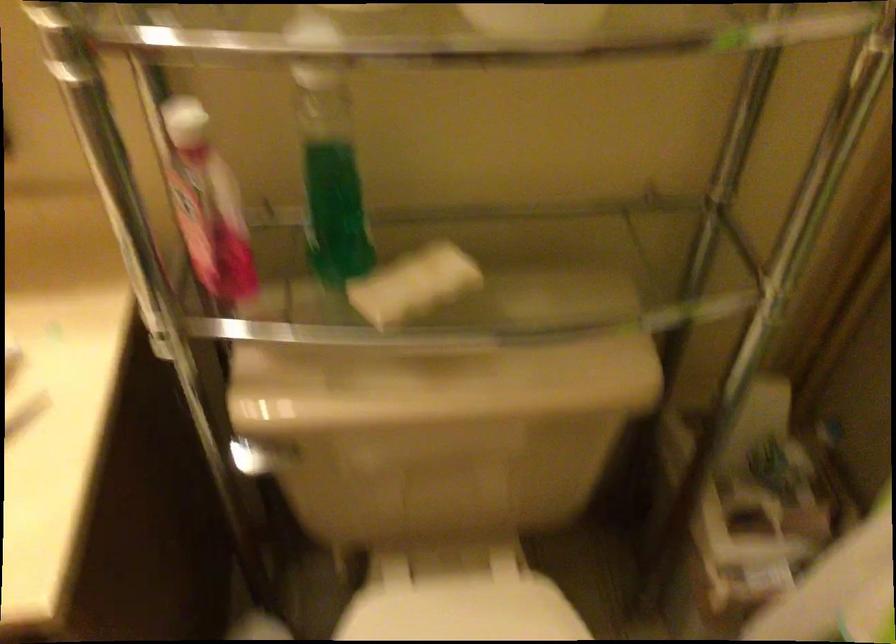
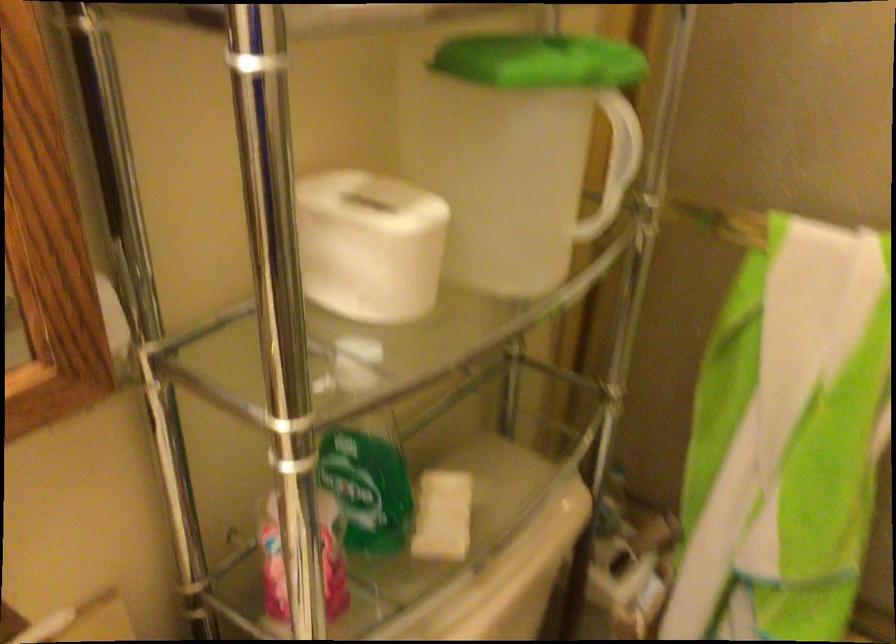
The point at [400,275] is marked in the first image. Where is the corresponding point in the second image?

(442, 516)